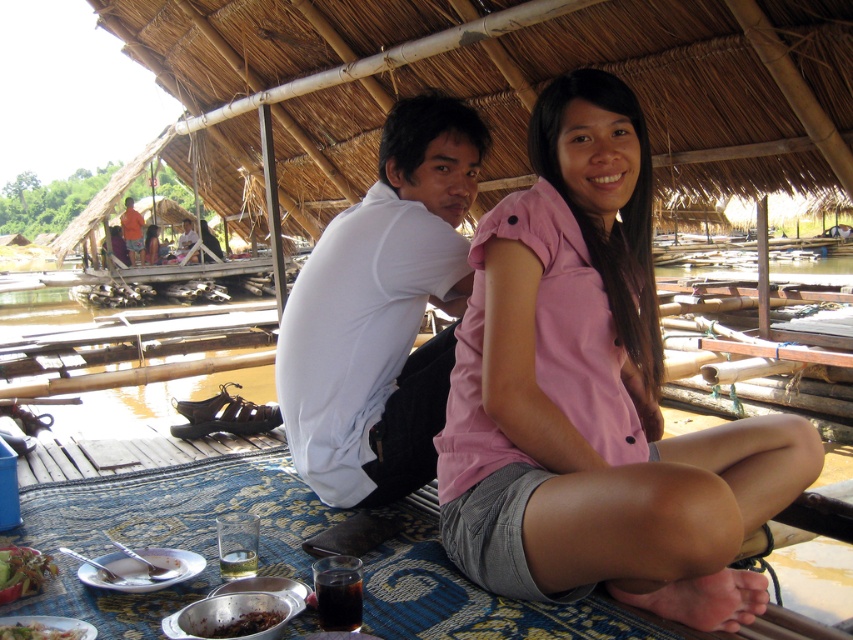
Between point (444, 180) and point (22, 557), which one is positioned behind?

The point (444, 180) is behind.

Looking at this image, who is lower down, white matte shirt at center or green leafy vegetables at lower left?

Positioned lower is green leafy vegetables at lower left.

Does point (403, 353) lie in front of point (22, 577)?

No, it is not.

Locate an element on the screen. white matte shirt at center is located at coordinates (381, 312).

Who is more distant from viewer, (577, 477) or (39, 636)?

The point (577, 477) is behind.

The image size is (853, 640). Identify the location of pink fabric shirt at center. (595, 396).

What are the coordinates of `pink fabric shirt at center` in the screenshot? It's located at (595, 396).

This screenshot has width=853, height=640. Find the location of `pink fabric shirt at center`. pink fabric shirt at center is located at coordinates (595, 396).

Consider the image. Can you confirm if pink fabric shirt at center is smaller than orange cotton shirt at upper left?

Yes.

Who is more forward, (x=485, y=529) or (x=122, y=236)?

Point (x=485, y=529) is more forward.

At what (x,y) coordinates should I click in order to perform the action: click on pink fabric shirt at center. Please return your answer as a coordinate pair (x, y). This screenshot has width=853, height=640. Looking at the image, I should click on (595, 396).